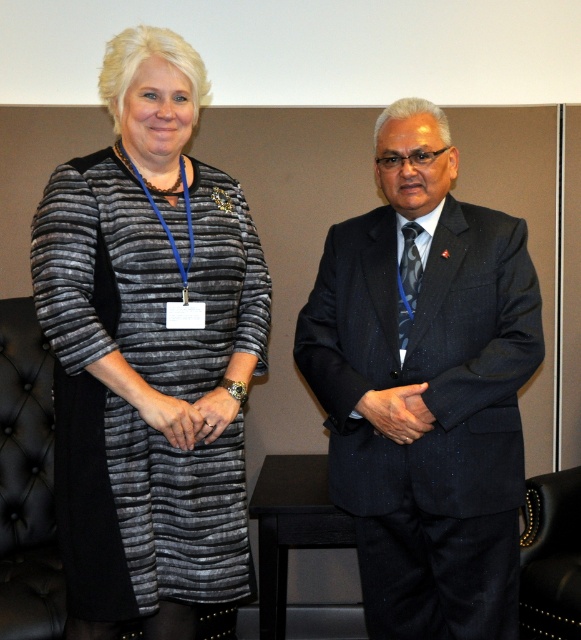
Question: In this image, where is striped fabric dress at center located relative to dark blue textured suit at right?

Choices:
 (A) below
 (B) above

Answer: (B)

Question: Which of the following is the farthest from the observer?

Choices:
 (A) dark blue textured suit at right
 (B) black leather armchair at lower right

Answer: (B)

Question: Which point is closer to the camera taking this photo?

Choices:
 (A) (23, 552)
 (B) (381, 502)
 (C) (572, 484)

Answer: (B)

Question: Which object is closer to the camera taking this photo?

Choices:
 (A) tufted leather armchair at lower left
 (B) striped fabric dress at center
 (C) black leather armchair at lower right
 (D) dark blue textured suit at right

Answer: (B)

Question: Considering the relative positions of dark blue textured suit at right and tufted leather armchair at lower left in the image provided, where is dark blue textured suit at right located with respect to tufted leather armchair at lower left?

Choices:
 (A) below
 (B) above

Answer: (B)

Question: Can you confirm if dark blue textured suit at right is thinner than black leather armchair at lower right?

Choices:
 (A) no
 (B) yes

Answer: (A)